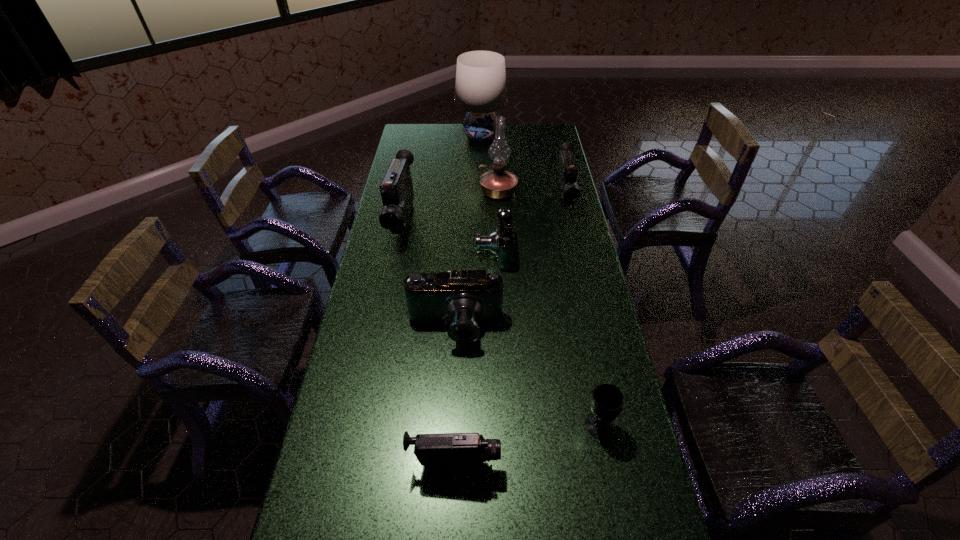
The height and width of the screenshot is (540, 960). What are the coordinates of `free space located on the front-facing side of the nearest camcorder` in the screenshot? It's located at (626, 464).

You are a GUI agent. You are given a task and a screenshot of the screen. Output one action in this format:
    pyautogui.click(x=<x>, y=<y>)
    Task: Click on the vacant space situated on the front of the chalice
    The width and height of the screenshot is (960, 540).
    Given the screenshot: What is the action you would take?
    pyautogui.click(x=609, y=471)

Locate an element on the screen. This screenshot has height=540, width=960. vacant area situated 0.290m on the front-facing side of the farther blue camcorder is located at coordinates (398, 251).

In order to click on vacant region located 0.200m on the front-facing side of the farther blue camcorder in this screenshot , I will do `click(422, 251)`.

Where is `free space located 0.170m on the front-facing side of the farther blue camcorder`? The height and width of the screenshot is (540, 960). free space located 0.170m on the front-facing side of the farther blue camcorder is located at coordinates (430, 251).

Image resolution: width=960 pixels, height=540 pixels. Identify the location of object positioned at the far edge. (480, 89).

The image size is (960, 540). What are the coordinates of `object present at the left edge` in the screenshot? It's located at (396, 188).

At what (x,y) coordinates should I click in order to perform the action: click on camcorder that is at the right edge. Please return your answer as a coordinate pair (x, y). Looking at the image, I should click on point(567,174).

Locate an element on the screen. Image resolution: width=960 pixels, height=540 pixels. chalice situated at the right edge is located at coordinates (607, 400).

At what (x,y) coordinates should I click in order to perform the action: click on free space at the far edge. Please return your answer as a coordinate pair (x, y). Looking at the image, I should click on (523, 125).